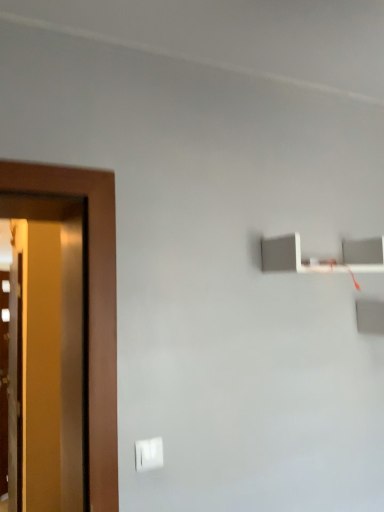
Question: Does white matte shelf at upper right have a lesser height compared to white plastic light switch at lower center?

Choices:
 (A) no
 (B) yes

Answer: (A)

Question: Considering the relative positions of white matte shelf at upper right and white plastic light switch at lower center in the image provided, is white matte shelf at upper right to the left of white plastic light switch at lower center from the viewer's perspective?

Choices:
 (A) no
 (B) yes

Answer: (A)

Question: Is white matte shelf at upper right bigger than white plastic light switch at lower center?

Choices:
 (A) yes
 (B) no

Answer: (A)

Question: Is white matte shelf at upper right positioned in front of white plastic light switch at lower center?

Choices:
 (A) yes
 (B) no

Answer: (B)

Question: Can you confirm if white matte shelf at upper right is positioned to the right of white plastic light switch at lower center?

Choices:
 (A) no
 (B) yes

Answer: (B)

Question: From the image's perspective, does white matte shelf at upper right appear lower than white plastic light switch at lower center?

Choices:
 (A) no
 (B) yes

Answer: (A)

Question: From the image's perspective, would you say white plastic light switch at lower center is shown under white matte shelf at upper right?

Choices:
 (A) no
 (B) yes

Answer: (B)

Question: Could white matte shelf at upper right be considered to be inside white plastic light switch at lower center?

Choices:
 (A) no
 (B) yes

Answer: (A)

Question: Can you confirm if white plastic light switch at lower center is taller than white matte shelf at upper right?

Choices:
 (A) no
 (B) yes

Answer: (A)

Question: Can you confirm if white plastic light switch at lower center is bigger than white matte shelf at upper right?

Choices:
 (A) no
 (B) yes

Answer: (A)

Question: Considering the relative positions of white plastic light switch at lower center and white matte shelf at upper right in the image provided, is white plastic light switch at lower center to the left of white matte shelf at upper right from the viewer's perspective?

Choices:
 (A) no
 (B) yes

Answer: (B)

Question: From a real-world perspective, is white plastic light switch at lower center located beneath white matte shelf at upper right?

Choices:
 (A) no
 (B) yes

Answer: (B)

Question: From a real-world perspective, is white matte shelf at upper right physically located above or below white plastic light switch at lower center?

Choices:
 (A) below
 (B) above

Answer: (B)